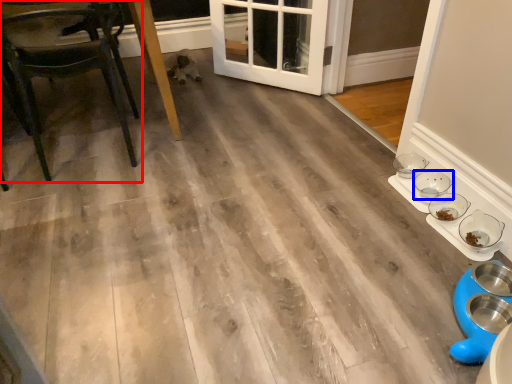
Question: Which object is further to the camera taking this photo, chair (highlighted by a red box) or bowl (highlighted by a blue box)?

Choices:
 (A) chair
 (B) bowl

Answer: (B)